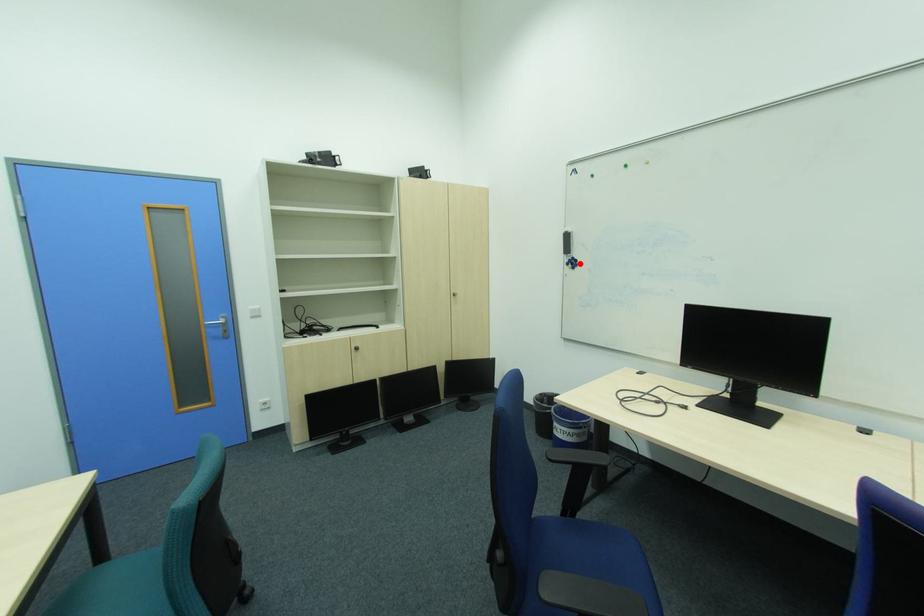
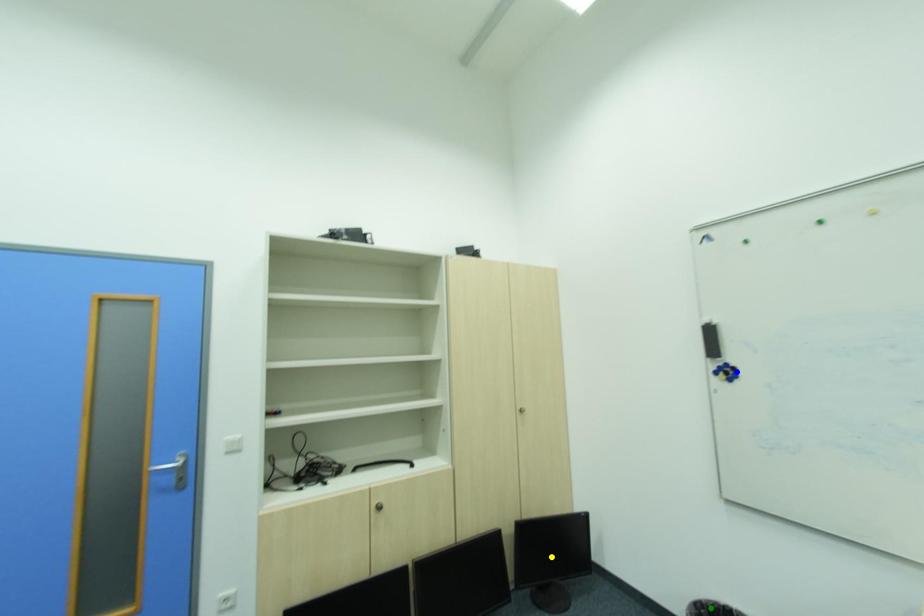
Question: I am providing you with two images of the same scene from different viewpoints. A red point is marked on the first image. You are given multiple points on the second image. Which point in image 2 is actually the same real-world point as the red point in image 1?

Choices:
 (A) green point
 (B) yellow point
 (C) blue point

Answer: (C)